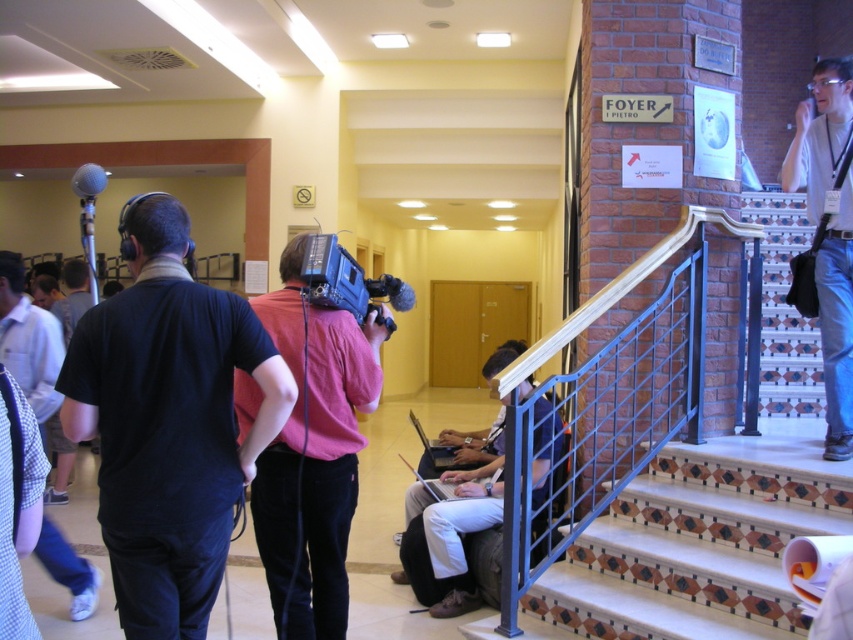
Question: Does black matte shirt at left appear under matte black camera at center?

Choices:
 (A) yes
 (B) no

Answer: (B)

Question: Which point appears closest to the camera in this image?

Choices:
 (A) (138, 264)
 (B) (318, 285)
 (C) (102, 180)
 (D) (314, 442)

Answer: (A)

Question: Where is white tiled stairs at lower right located in relation to white tiled stairwell at right in the image?

Choices:
 (A) below
 (B) above

Answer: (A)

Question: Which point is closer to the camera taking this photo?

Choices:
 (A) (502, 356)
 (B) (74, 173)
 (C) (802, 212)

Answer: (A)

Question: Which of these objects is positioned farthest from the black matte shirt at left?

Choices:
 (A) blue jeans at right
 (B) white tiled stairwell at right

Answer: (B)

Question: Can you confirm if white tiled stairs at lower right is positioned to the right of white tiled stairwell at right?

Choices:
 (A) no
 (B) yes

Answer: (A)